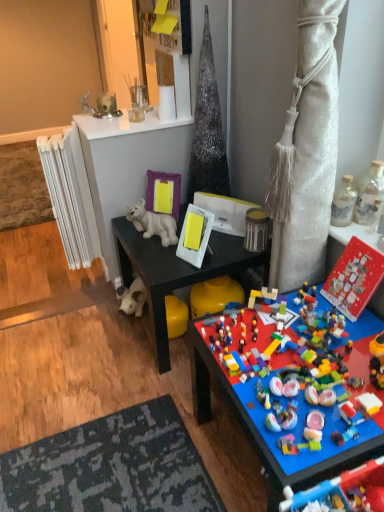
Where is `clear glass bottles at right, the 7th toy from the bottom`? The height and width of the screenshot is (512, 384). clear glass bottles at right, the 7th toy from the bottom is located at coordinates (370, 195).

Image resolution: width=384 pixels, height=512 pixels. What do you see at coordinates (70, 196) in the screenshot?
I see `white metallic radiator at left` at bounding box center [70, 196].

Describe the element at coordinates (153, 223) in the screenshot. I see `white glossy plastic toy at center, acting as the fifth toy starting from the bottom` at that location.

Locate an element on the screen. purple matte picture frame at upper center, the first picture frame positioned from the top is located at coordinates (163, 193).

Is sparkly silver christmas tree at center with white metallic radiator at left?

No, sparkly silver christmas tree at center is not with white metallic radiator at left.

Is sparkly silver christmas tree at center bigger than white metallic radiator at left?

Yes.

Considering the sizes of objects sparkly silver christmas tree at center and white metallic radiator at left in the image provided, who is thinner, sparkly silver christmas tree at center or white metallic radiator at left?

white metallic radiator at left is thinner.

Is sparkly silver christmas tree at center positioned with its back to white metallic radiator at left?

No, sparkly silver christmas tree at center is not facing the opposite direction of white metallic radiator at left.

From the picture: How far apart are purple matte picture frame at upper center, the first picture frame positioned from the back, and sparkly silver christmas tree at center?

purple matte picture frame at upper center, the first picture frame positioned from the back, is 8.56 inches away from sparkly silver christmas tree at center.

Is purple matte picture frame at upper center, the first picture frame positioned from the back, smaller than sparkly silver christmas tree at center?

Indeed, purple matte picture frame at upper center, the first picture frame positioned from the back, has a smaller size compared to sparkly silver christmas tree at center.

Identify the location of the 1st picture frame positioned below the sparkly silver christmas tree at center (from the image's perspective). This screenshot has height=512, width=384. (163, 193).

Would you say purple matte picture frame at upper center, which is the 2th picture frame in bottom-to-top order, is to the left or to the right of sparkly silver christmas tree at center in the picture?

purple matte picture frame at upper center, which is the 2th picture frame in bottom-to-top order, is to the left of sparkly silver christmas tree at center.

Is the surface of metallic silver candlestick at upper center, the first toy from the top, in direct contact with white glossy plastic toy at center, acting as the fifth toy starting from the bottom?

metallic silver candlestick at upper center, the first toy from the top, is not next to white glossy plastic toy at center, acting as the fifth toy starting from the bottom, and they're not touching.

Considering the relative positions of metallic silver candlestick at upper center, the eighth toy from the bottom, and white glossy plastic toy at center, arranged as the fourth toy when viewed from the top, in the image provided, is metallic silver candlestick at upper center, the eighth toy from the bottom, behind white glossy plastic toy at center, arranged as the fourth toy when viewed from the top,?

Yes, metallic silver candlestick at upper center, the eighth toy from the bottom, is behind white glossy plastic toy at center, arranged as the fourth toy when viewed from the top.

What's the angular difference between metallic silver candlestick at upper center, the eighth toy from the bottom, and white glossy plastic toy at center, acting as the fifth toy starting from the bottom,'s facing directions?

They differ by 39.7 degrees in their facing directions.

Which point is more forward, [100,96] or [134,210]?

The point [134,210] is closer to the camera.

Is translucent plastic toy at lower right, marked as the 1th toy in a bottom-to-top arrangement, next to red matte advent calendar at lower right, which is the 6th toy in top-to-bottom order?

No, translucent plastic toy at lower right, marked as the 1th toy in a bottom-to-top arrangement, is not beside red matte advent calendar at lower right, which is the 6th toy in top-to-bottom order.

Is point (379, 465) positioned after point (373, 264)?

No, it is in front of (373, 264).

Locate an element on the screen. toy that is the 2nd object located in front of the red matte advent calendar at lower right, which is the 6th toy in top-to-bottom order is located at coordinates (330, 485).

Is red matte advent calendar at lower right, which is the 6th toy in top-to-bottom order, turned away from clear glass bottle at upper right, which is the third toy from top to bottom?

No, red matte advent calendar at lower right, which is the 6th toy in top-to-bottom order, is not facing away from clear glass bottle at upper right, which is the third toy from top to bottom.

Is point (360, 277) positioned behind point (344, 184)?

No.

How distant is red matte advent calendar at lower right, positioned as the 3th toy in bottom-to-top order, from clear glass bottle at upper right, which is the third toy from top to bottom?

red matte advent calendar at lower right, positioned as the 3th toy in bottom-to-top order, is 6.91 inches from clear glass bottle at upper right, which is the third toy from top to bottom.

You are a GUI agent. You are given a task and a screenshot of the screen. Output one action in this format:
    pyautogui.click(x=<x>, y=<y>)
    Task: Click on the 2nd toy behind the red matte advent calendar at lower right, positioned as the 3th toy in bottom-to-top order
    The width and height of the screenshot is (384, 512).
    Given the screenshot: What is the action you would take?
    click(x=343, y=202)

Is white plastic picture frame at center, the 2th picture frame viewed from the left, inside the boundaries of clear glass bottles at right, the 7th toy from the bottom, or outside?

The correct answer is: outside.

Considering the positions of objects white plastic picture frame at center, which is the 1th picture frame from bottom to top, and clear glass bottles at right, the 7th toy from the bottom, in the image provided, who is in front, white plastic picture frame at center, which is the 1th picture frame from bottom to top, or clear glass bottles at right, the 7th toy from the bottom,?

clear glass bottles at right, the 7th toy from the bottom.

Is white plastic picture frame at center, which is the 1th picture frame from bottom to top, at the left side of clear glass bottles at right, which ranks as the second toy in top-to-bottom order?

Indeed, white plastic picture frame at center, which is the 1th picture frame from bottom to top, is positioned on the left side of clear glass bottles at right, which ranks as the second toy in top-to-bottom order.

Looking at this image, from a real-world perspective, is white plastic picture frame at center, the 2th picture frame viewed from the left, physically above clear glass bottles at right, which ranks as the second toy in top-to-bottom order?

No.

Measure the distance between clear glass bottle at upper right, which is the third toy from top to bottom, and sparkly silver christmas tree at center.

clear glass bottle at upper right, which is the third toy from top to bottom, is 26.69 inches away from sparkly silver christmas tree at center.

From a real-world perspective, relative to sparkly silver christmas tree at center, is clear glass bottle at upper right, which is the third toy from top to bottom, vertically above or below?

From a real-world perspective, clear glass bottle at upper right, which is the third toy from top to bottom, is physically below sparkly silver christmas tree at center.

Can you confirm if clear glass bottle at upper right, which is the third toy from top to bottom, is smaller than sparkly silver christmas tree at center?

Indeed, clear glass bottle at upper right, which is the third toy from top to bottom, has a smaller size compared to sparkly silver christmas tree at center.

Which is in front, clear glass bottle at upper right, positioned as the 6th toy in bottom-to-top order, or sparkly silver christmas tree at center?

Positioned in front is clear glass bottle at upper right, positioned as the 6th toy in bottom-to-top order.

You are a GUI agent. You are given a task and a screenshot of the screen. Output one action in this format:
    pyautogui.click(x=<x>, y=<y>)
    Task: Click on the christmas tree on the right of white metallic radiator at left
    The width and height of the screenshot is (384, 512).
    Given the screenshot: What is the action you would take?
    pyautogui.click(x=207, y=128)

You are a GUI agent. You are given a task and a screenshot of the screen. Output one action in this format:
    pyautogui.click(x=<x>, y=<y>)
    Task: Click on the christmas tree in front of the purple matte picture frame at upper center, the first picture frame positioned from the top
    This screenshot has width=384, height=512.
    Given the screenshot: What is the action you would take?
    pyautogui.click(x=207, y=128)

Based on their spatial positions, is white metallic radiator at left or sparkly silver christmas tree at center closer to red matte advent calendar at lower right, which is the 6th toy in top-to-bottom order?

The object closer to red matte advent calendar at lower right, which is the 6th toy in top-to-bottom order, is sparkly silver christmas tree at center.

When comparing their distances from black matte desk at center, does clear glass bottles at right, the 7th toy from the bottom, or white plastic picture frame at center, which appears as the first picture frame when viewed from the front, seem further?

clear glass bottles at right, the 7th toy from the bottom, is positioned further to the anchor black matte desk at center.

When comparing their distances from clear glass bottles at right, which ranks as the second toy in top-to-bottom order, does clear glass bottle at upper right, which is the third toy from top to bottom, or red matte advent calendar at lower right, positioned as the 3th toy in bottom-to-top order, seem closer?

Among the two, clear glass bottle at upper right, which is the third toy from top to bottom, is located nearer to clear glass bottles at right, which ranks as the second toy in top-to-bottom order.

Which object lies nearer to the anchor point clear glass bottle at upper right, positioned as the 6th toy in bottom-to-top order, black matte desk at center or translucent plastic toy at lower right, marked as the 1th toy in a bottom-to-top arrangement?

black matte desk at center lies closer to clear glass bottle at upper right, positioned as the 6th toy in bottom-to-top order, than the other object.

When comparing their distances from red matte advent calendar at lower right, which is the 6th toy in top-to-bottom order, does clear glass bottle at upper right, which is the third toy from top to bottom, or purple matte picture frame at upper center, which is counted as the second picture frame, starting from the right, seem closer?

clear glass bottle at upper right, which is the third toy from top to bottom.

Which object lies further to the anchor point multicolored plastic lego pieces at lower right, the 2th toy when ordered from bottom to top, white glossy plastic toy at center, arranged as the fourth toy when viewed from the top, or clear glass bottles at right, which ranks as the second toy in top-to-bottom order?

The object further to multicolored plastic lego pieces at lower right, the 2th toy when ordered from bottom to top, is white glossy plastic toy at center, arranged as the fourth toy when viewed from the top.

Based on their spatial positions, is white plastic picture frame at center, which appears as the first picture frame when viewed from the front, or red matte advent calendar at lower right, which is the 6th toy in top-to-bottom order, closer to multicolored plastic lego pieces at lower right, which is counted as the seventh toy, starting from the top?

red matte advent calendar at lower right, which is the 6th toy in top-to-bottom order, is positioned closer to the anchor multicolored plastic lego pieces at lower right, which is counted as the seventh toy, starting from the top.

Looking at the image, which one is located closer to white plastic picture frame at center, the 1th picture frame positioned from the right, metallic silver candlestick at upper center, the eighth toy from the bottom, or purple matte picture frame at upper center, arranged as the second picture frame when viewed from the front?

purple matte picture frame at upper center, arranged as the second picture frame when viewed from the front, lies closer to white plastic picture frame at center, the 1th picture frame positioned from the right, than the other object.

Where is `picture frame between black matte desk at center and clear glass bottles at right, the 7th toy from the bottom`? picture frame between black matte desk at center and clear glass bottles at right, the 7th toy from the bottom is located at coordinates (195, 234).

The height and width of the screenshot is (512, 384). Find the location of `picture frame between metallic silver candlestick at upper center, the eighth toy from the bottom, and white glossy plastic toy at center, arranged as the fourth toy when viewed from the top, vertically`. picture frame between metallic silver candlestick at upper center, the eighth toy from the bottom, and white glossy plastic toy at center, arranged as the fourth toy when viewed from the top, vertically is located at coordinates (163, 193).

The image size is (384, 512). I want to click on desk between metallic silver candlestick at upper center, the eighth toy from the bottom, and clear glass bottle at upper right, which is the third toy from top to bottom, from left to right, so click(x=178, y=272).

You are a GUI agent. You are given a task and a screenshot of the screen. Output one action in this format:
    pyautogui.click(x=<x>, y=<y>)
    Task: Click on the desk that lies between metallic silver candlestick at upper center, the first toy from the top, and translucent plastic toy at lower right, the eighth toy from the top, from top to bottom
    
    Given the screenshot: What is the action you would take?
    pyautogui.click(x=178, y=272)